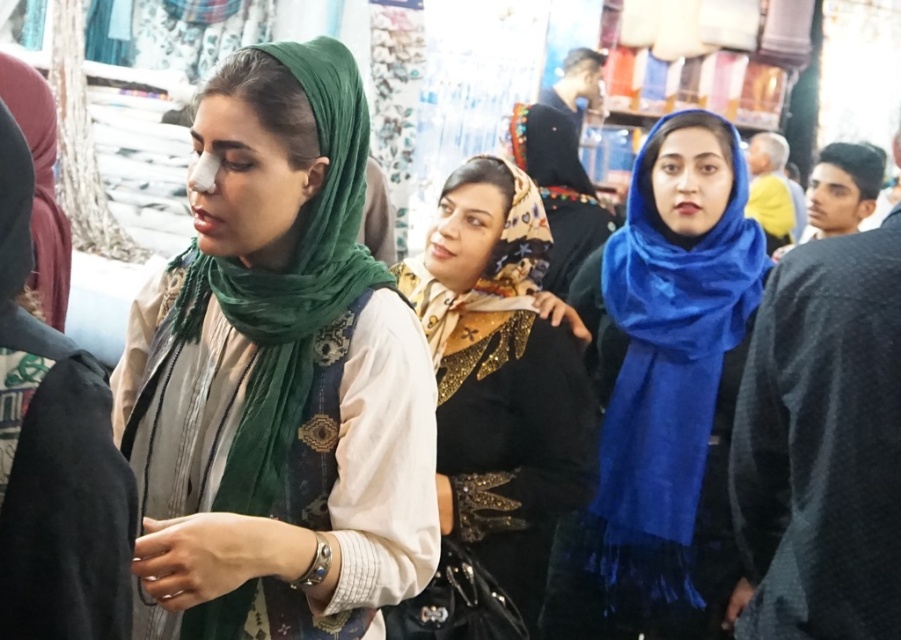
You are a photographer at the market and want to capture the green silk scarf at center and the shiny gold dress at center in a single photo. Based on their positions, which object should you focus on first to ensure both are in frame?

The green silk scarf at center is above the shiny gold dress at center, so you should focus on the shiny gold dress at center first to ensure both are in frame.

You are a customer in the market and want to buy an item that is shorter than the other. Which item should you choose between the shiny gold dress at center and the blue silk scarf at center?

The shiny gold dress at center is shorter than the blue silk scarf at center, so you should choose the shiny gold dress at center.

Please describe the location of the point at coordinates (x=501, y=376) in the image. Which object does it belong to?

The point at coordinates (x=501, y=376) is located on the shiny gold dress at center.